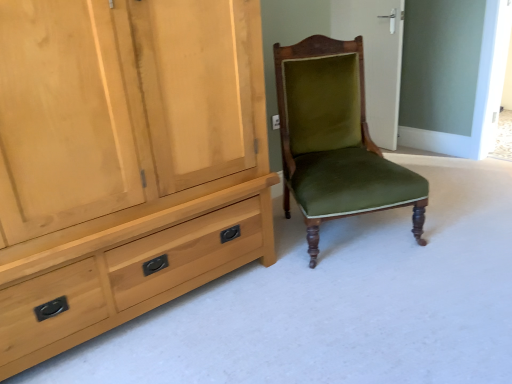
You are a GUI agent. You are given a task and a screenshot of the screen. Output one action in this format:
    pyautogui.click(x=<x>, y=<y>)
    Task: Click on the vacant space in front of velvet green chair at center
    The width and height of the screenshot is (512, 384).
    Given the screenshot: What is the action you would take?
    pyautogui.click(x=373, y=292)